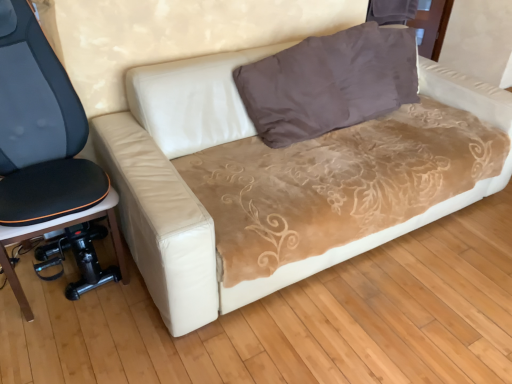
Question: Is beige suede couch at center completely or partially inside black fabric office chair at left?

Choices:
 (A) no
 (B) yes

Answer: (A)

Question: From a real-world perspective, is black fabric office chair at left beneath beige suede couch at center?

Choices:
 (A) no
 (B) yes

Answer: (A)

Question: Is black fabric office chair at left positioned before beige suede couch at center?

Choices:
 (A) no
 (B) yes

Answer: (A)

Question: Considering the relative sizes of black fabric office chair at left and beige suede couch at center in the image provided, is black fabric office chair at left shorter than beige suede couch at center?

Choices:
 (A) no
 (B) yes

Answer: (A)

Question: From a real-world perspective, is black fabric office chair at left on top of beige suede couch at center?

Choices:
 (A) no
 (B) yes

Answer: (B)

Question: Visually, is beige suede couch at center positioned to the left or to the right of black fabric office chair at left?

Choices:
 (A) left
 (B) right

Answer: (B)

Question: Considering the positions of point 285,44 and point 59,104, is point 285,44 closer or farther from the camera than point 59,104?

Choices:
 (A) closer
 (B) farther

Answer: (B)

Question: From a real-world perspective, is beige suede couch at center above or below black fabric office chair at left?

Choices:
 (A) below
 (B) above

Answer: (A)

Question: Is beige suede couch at center wider or thinner than black fabric office chair at left?

Choices:
 (A) thin
 (B) wide

Answer: (B)

Question: In terms of size, does black fabric office chair at left appear bigger or smaller than brown velvety pillow at upper center?

Choices:
 (A) big
 (B) small

Answer: (A)

Question: Choose the correct answer: Is black fabric office chair at left inside brown velvety pillow at upper center or outside it?

Choices:
 (A) inside
 (B) outside

Answer: (B)

Question: Is point (61, 195) positioned closer to the camera than point (394, 64)?

Choices:
 (A) closer
 (B) farther

Answer: (A)

Question: From a real-world perspective, is black fabric office chair at left positioned above or below brown velvety pillow at upper center?

Choices:
 (A) above
 (B) below

Answer: (B)

Question: Looking at their shapes, would you say beige suede couch at center is wider or thinner than brown velvety pillow at upper center?

Choices:
 (A) wide
 (B) thin

Answer: (A)

Question: From the image's perspective, relative to brown velvety pillow at upper center, is beige suede couch at center above or below?

Choices:
 (A) above
 (B) below

Answer: (B)